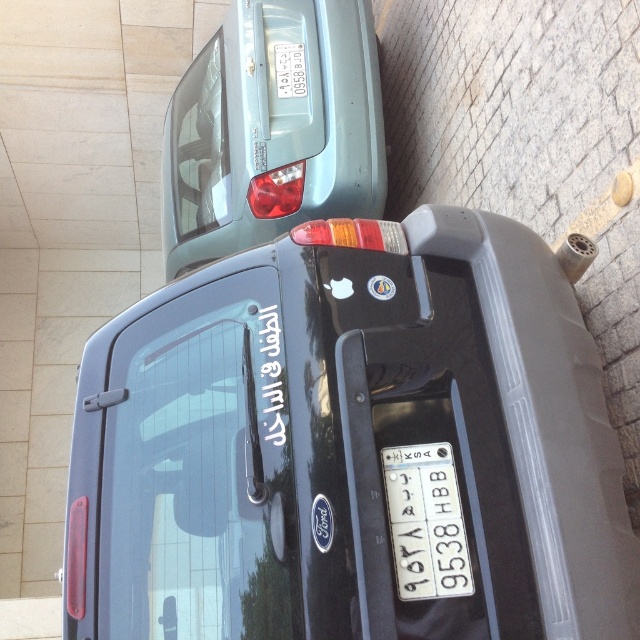
You are a parking attendant checking the vehicles in the lot. You see the satin metallic car at upper center and the white plastic license plate at center. Which object is positioned higher in the image?

The satin metallic car at upper center is positioned higher than the white plastic license plate at center in the image.

You are standing at the rear of the satin metallic car at upper center. Based on the scene description, can you determine if there is another car parked behind it?

The satin metallic car at upper center is located at point (273, 129), but the scene description mentions another car partially visible behind it. Therefore, there is another car parked behind the satin metallic car at upper center.